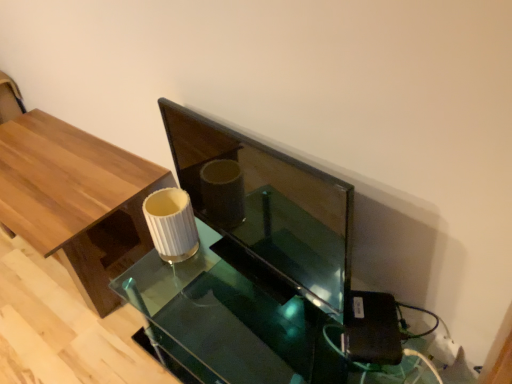
Find the location of `free point above wooden table at left (from a real-world perspective)`. free point above wooden table at left (from a real-world perspective) is located at coordinates (54, 166).